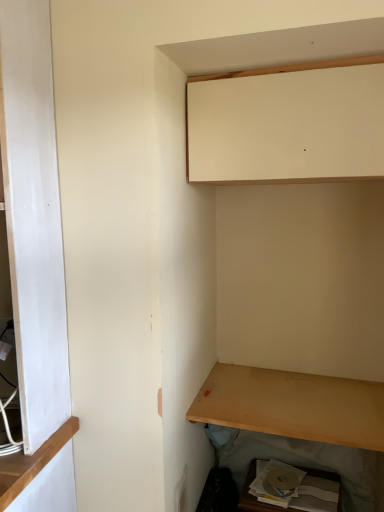
The image size is (384, 512). I want to click on free space above light brown wood shelf at lower right (from a real-world perspective), so click(x=303, y=396).